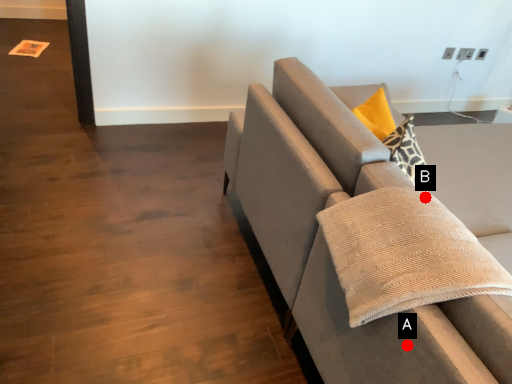
Question: Two points are circled on the image, labeled by A and B beside each circle. Which point appears closest to the camera in this image?

Choices:
 (A) A is closer
 (B) B is closer

Answer: (A)